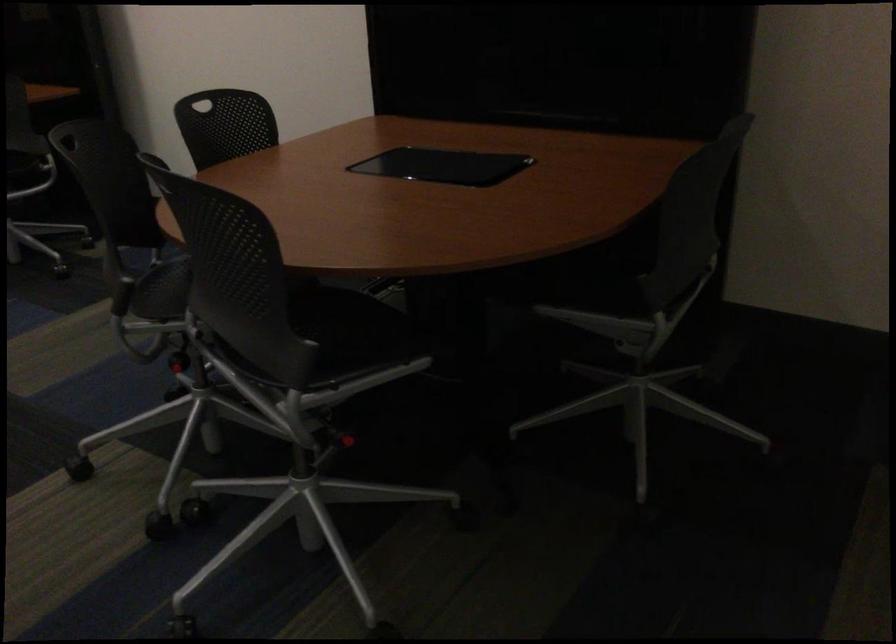
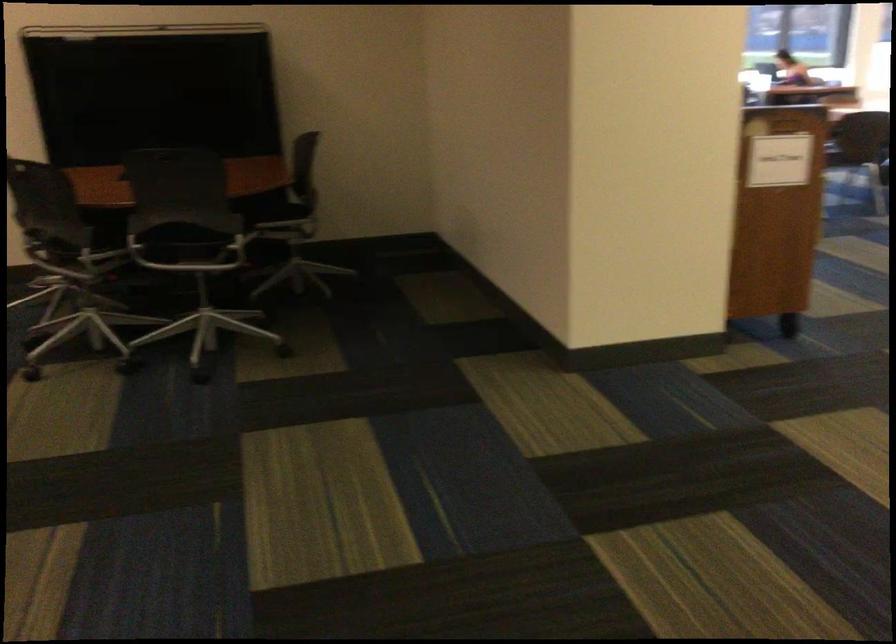
Question: I am providing you with two images of the same scene from different viewpoints. Which of the following objects are not visible in image2?

Choices:
 (A) metal chair armrest
 (B) red chair lever
 (C) silver track light
 (D) black chair sitting surface

Answer: (B)